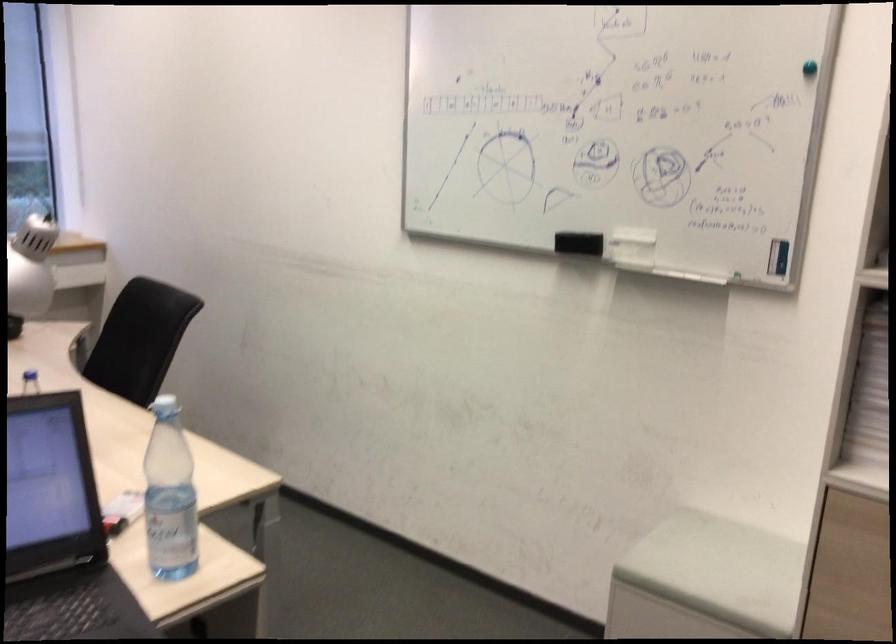
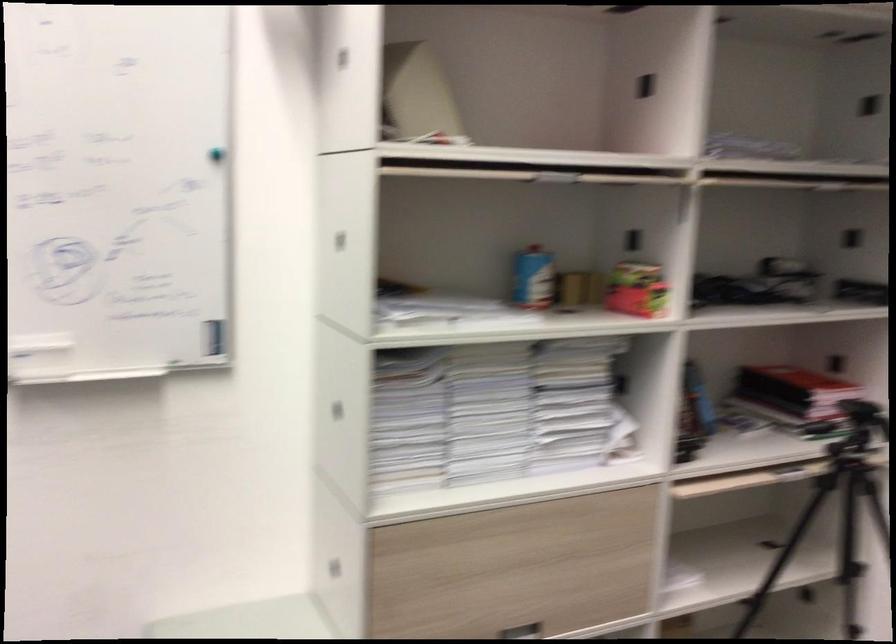
The point at (624, 241) is marked in the first image. Where is the corresponding point in the second image?

(33, 350)